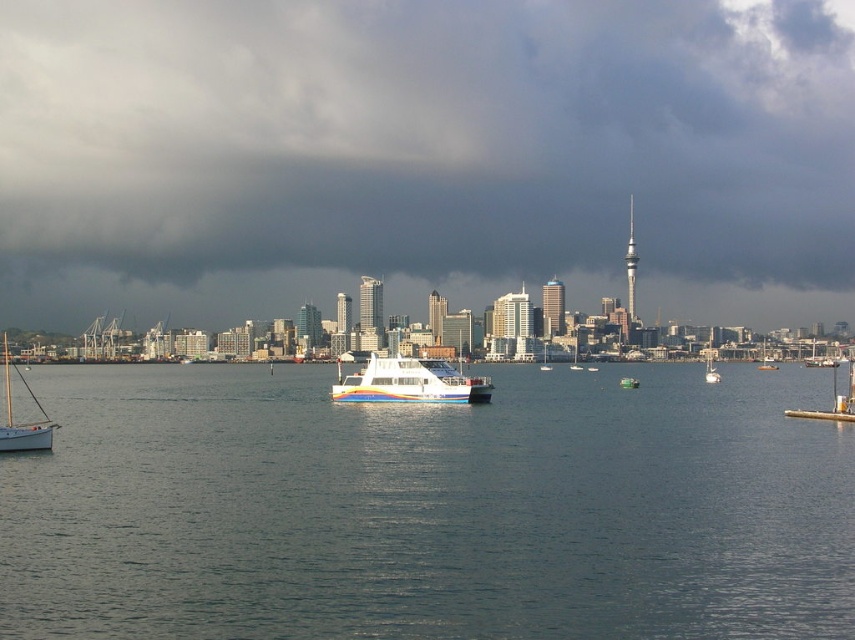
Does point (3, 362) come farther from viewer compared to point (624, 381)?

Yes, it is.

Between white wooden sailboat at lower left and multicolored plastic boat at center, which one appears on the right side from the viewer's perspective?

Positioned to the right is multicolored plastic boat at center.

Which is in front, point (18, 435) or point (628, 378)?

Point (18, 435) is in front.

What are the coordinates of `white wooden sailboat at lower left` in the screenshot? It's located at (22, 422).

Between rainbow painted ferry at center and metallic silver boat at center, which one is positioned lower?

metallic silver boat at center is lower down.

Does rainbow painted ferry at center have a lesser width compared to metallic silver boat at center?

No.

Identify the location of rainbow painted ferry at center. Image resolution: width=855 pixels, height=640 pixels. (410, 381).

Where is `rainbow painted ferry at center`? The image size is (855, 640). rainbow painted ferry at center is located at coordinates (410, 381).

Is white wooden sailboat at lower left behind white glossy boat at center?

No.

Who is more forward, (7, 376) or (768, 364)?

Point (768, 364) is more forward.

What are the coordinates of `white wooden sailboat at lower left` in the screenshot? It's located at (22, 422).